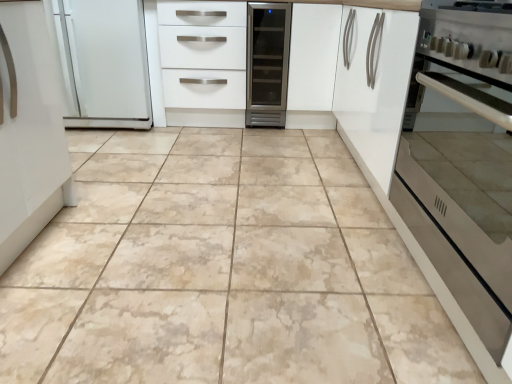
Question: Is white glossy drawers at center facing away from satin silver oven at right?

Choices:
 (A) yes
 (B) no

Answer: (B)

Question: Considering the relative sizes of white glossy drawers at center and satin silver oven at right in the image provided, is white glossy drawers at center taller than satin silver oven at right?

Choices:
 (A) no
 (B) yes

Answer: (B)

Question: Considering the relative sizes of white glossy drawers at center and satin silver oven at right in the image provided, is white glossy drawers at center wider than satin silver oven at right?

Choices:
 (A) yes
 (B) no

Answer: (A)

Question: From a real-world perspective, is white glossy drawers at center physically above satin silver oven at right?

Choices:
 (A) yes
 (B) no

Answer: (A)

Question: From a real-world perspective, is white glossy drawers at center below satin silver oven at right?

Choices:
 (A) yes
 (B) no

Answer: (B)

Question: From the image's perspective, is white glossy drawers at center above satin silver oven at right?

Choices:
 (A) no
 (B) yes

Answer: (B)

Question: From a real-world perspective, is white matte cabinet at center below beige marble tile at center?

Choices:
 (A) yes
 (B) no

Answer: (B)

Question: Is white matte cabinet at center oriented towards beige marble tile at center?

Choices:
 (A) yes
 (B) no

Answer: (B)

Question: Is white matte cabinet at center taller than beige marble tile at center?

Choices:
 (A) no
 (B) yes

Answer: (B)

Question: Is white matte cabinet at center not inside beige marble tile at center?

Choices:
 (A) yes
 (B) no

Answer: (A)

Question: Is white matte cabinet at center facing away from beige marble tile at center?

Choices:
 (A) yes
 (B) no

Answer: (B)

Question: Is white matte cabinet at center bigger than beige marble tile at center?

Choices:
 (A) yes
 (B) no

Answer: (B)

Question: Is white glossy drawers at center looking in the opposite direction of beige marble tile at center?

Choices:
 (A) yes
 (B) no

Answer: (B)